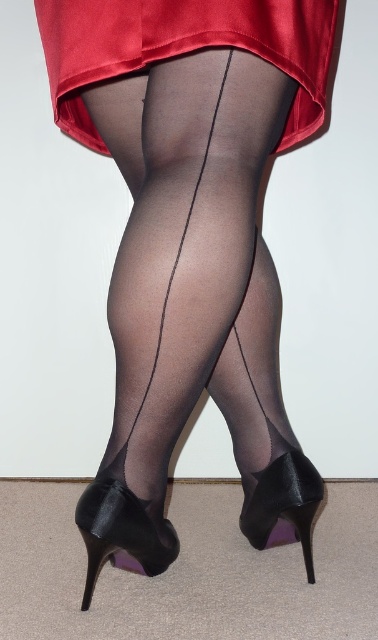
You are a fashion designer analyzing a photo of a model wearing sheer black tights and a red skirt. The model has a point marked at coordinates (122, 532). Based on the image description, what object is located at this coordinate?

The point at coordinates (122, 532) indicates the location of the black satin shoe at lower center.

You are a fashion designer trying to place a new accessory on the model. The accessory requires a specific placement at coordinates between 0.05 and 0.5 on the x and y axes. Can the accessory be placed on the satin dress at upper center?

The satin dress at upper center is located at point [182,49], which falls within the required x and y coordinate range of 0.05 to 0.5. Therefore, the accessory can be placed there.